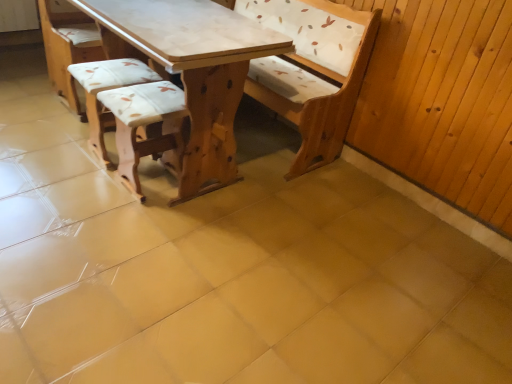
Question: Is light brown wood table at center not inside wooden textured stool at center, the second armchair positioned from the left?

Choices:
 (A) no
 (B) yes

Answer: (B)

Question: Does light brown wood table at center touch wooden textured stool at center, which is the first armchair in right-to-left order?

Choices:
 (A) yes
 (B) no

Answer: (B)

Question: Does light brown wood table at center come behind wooden textured stool at center, the second armchair positioned from the left?

Choices:
 (A) yes
 (B) no

Answer: (B)

Question: From the image's perspective, is light brown wood table at center under wooden textured stool at center, which is the first armchair in right-to-left order?

Choices:
 (A) no
 (B) yes

Answer: (A)

Question: Can you confirm if light brown wood table at center is thinner than wooden textured stool at center, the second armchair positioned from the left?

Choices:
 (A) yes
 (B) no

Answer: (B)

Question: Would you say wooden textured stool at center, which is the first armchair in right-to-left order, is to the left or to the right of white fabric cushion at center, the first armchair in the left-to-right sequence, in the picture?

Choices:
 (A) right
 (B) left

Answer: (A)

Question: Is wooden textured stool at center, which is the first armchair in right-to-left order, taller or shorter than white fabric cushion at center, positioned as the 2th armchair in right-to-left order?

Choices:
 (A) short
 (B) tall

Answer: (B)

Question: Is wooden textured stool at center, the second armchair positioned from the left, in front of or behind white fabric cushion at center, positioned as the 2th armchair in right-to-left order, in the image?

Choices:
 (A) front
 (B) behind

Answer: (A)

Question: From the image's perspective, is wooden textured stool at center, the second armchair positioned from the left, positioned above or below white fabric cushion at center, the first armchair in the left-to-right sequence?

Choices:
 (A) below
 (B) above

Answer: (A)

Question: From a real-world perspective, is light brown wood table at center physically located above or below white fabric cushion at center, positioned as the 2th armchair in right-to-left order?

Choices:
 (A) below
 (B) above

Answer: (B)

Question: Is point [113, 61] positioned closer to the camera than point [99, 155]?

Choices:
 (A) closer
 (B) farther

Answer: (A)

Question: From their relative heights in the image, would you say light brown wood table at center is taller or shorter than white fabric cushion at center, the first armchair in the left-to-right sequence?

Choices:
 (A) tall
 (B) short

Answer: (A)

Question: Is light brown wood table at center in front of or behind white fabric cushion at center, positioned as the 2th armchair in right-to-left order, in the image?

Choices:
 (A) front
 (B) behind

Answer: (A)

Question: Does point (257, 36) appear closer or farther from the camera than point (118, 160)?

Choices:
 (A) closer
 (B) farther

Answer: (A)

Question: From the image's perspective, is light brown wood table at center located above or below wooden textured stool at center, which is the first armchair in right-to-left order?

Choices:
 (A) above
 (B) below

Answer: (A)